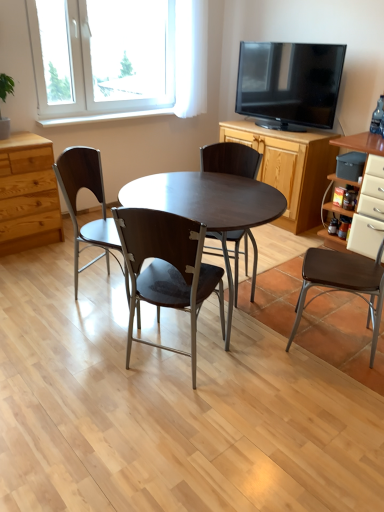
Locate an element on the screen. Image resolution: width=384 pixels, height=512 pixels. vacant area that lies between matte brown chair at center, marked as the 2th chair in a left-to-right arrangement, and matte dark wood table at center is located at coordinates (166, 348).